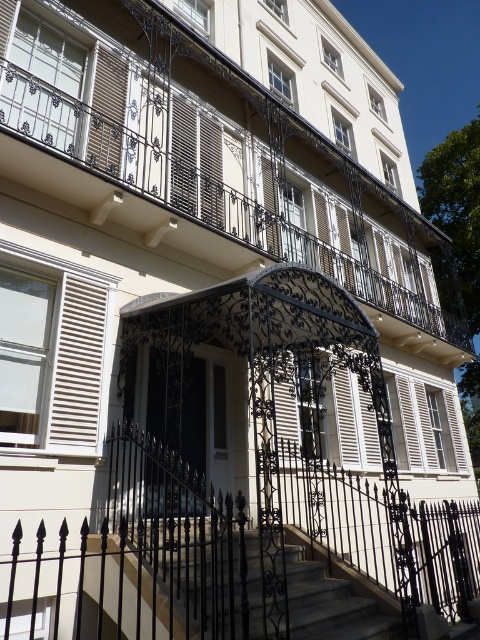
You are standing at the entrance of the classical building and want to walk up the stairs. Which object, the black wrought iron balcony at center or the smooth stone stairs at center, is wider so you can choose the path with more space?

The black wrought iron balcony at center is wider than the smooth stone stairs at center, so you can choose the path with more space by taking the black wrought iron balcony at center.